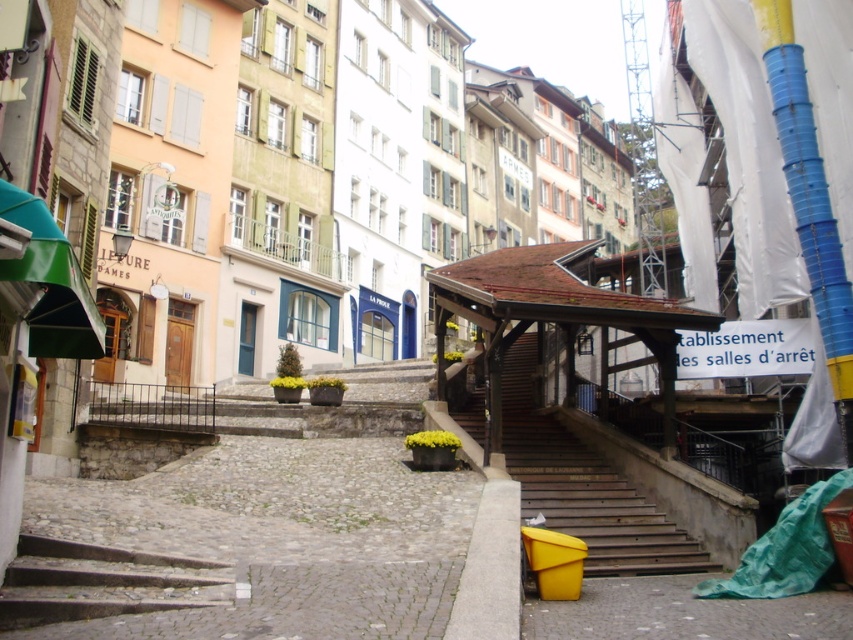
Is wooden stairs at center taller than dark gray concrete stairs at lower left?

Correct, wooden stairs at center is much taller as dark gray concrete stairs at lower left.

Is wooden stairs at center thinner than dark gray concrete stairs at lower left?

In fact, wooden stairs at center might be wider than dark gray concrete stairs at lower left.

Does point (514, 440) lie in front of point (0, 628)?

No, (514, 440) is behind (0, 628).

The image size is (853, 640). In order to click on wooden stairs at center in this screenshot , I will do `click(584, 486)`.